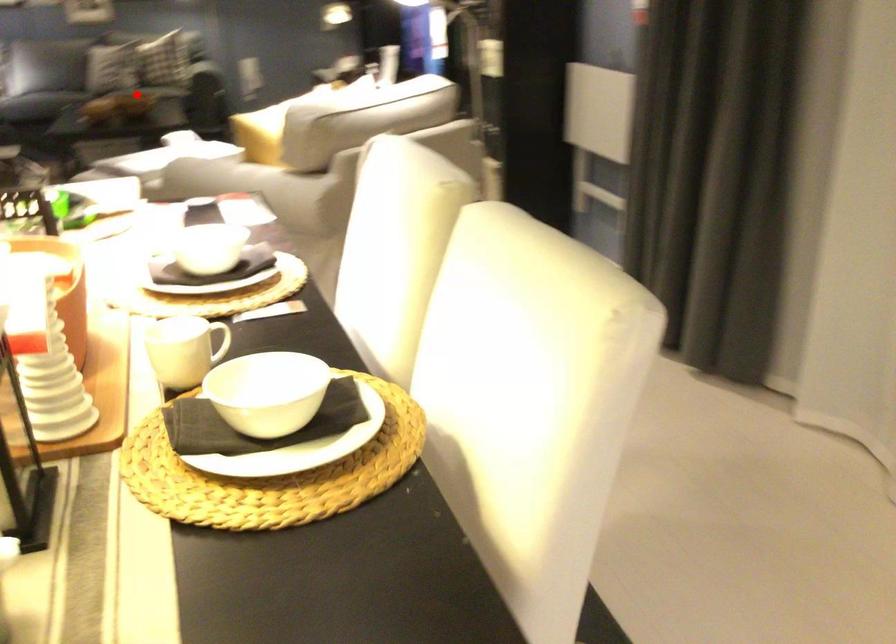
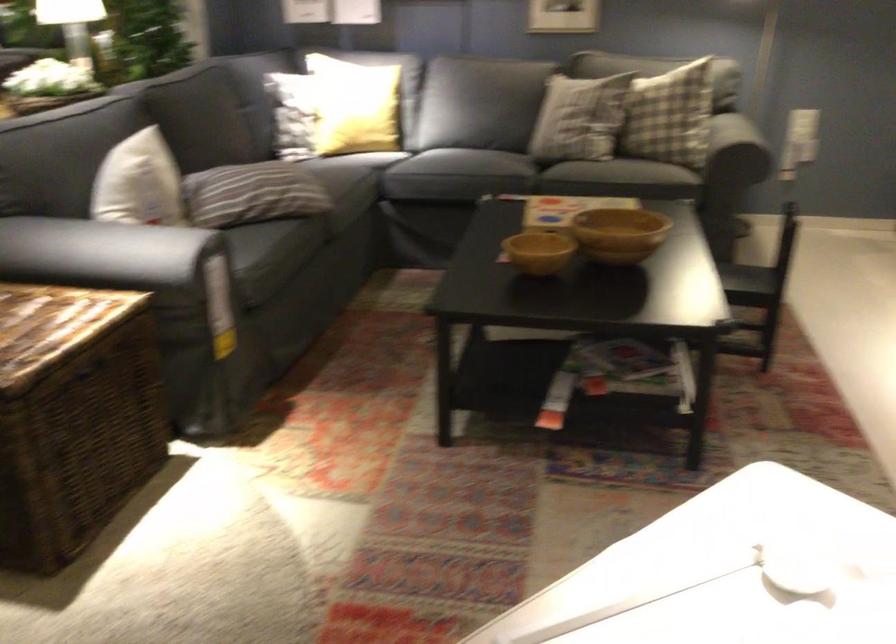
Where in the second image is the point corresponding to the highlighted location from the first image?

(618, 234)